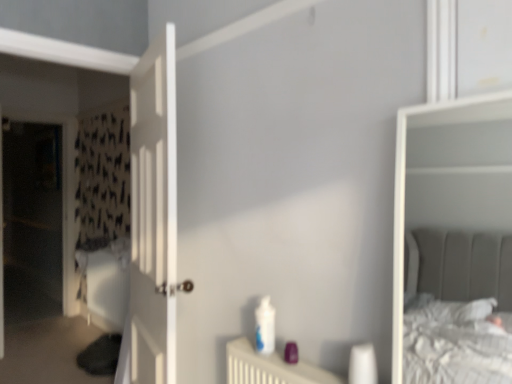
Identify the location of vacant region above transparent plastic screen door at left (from a real-world perspective). (36, 106).